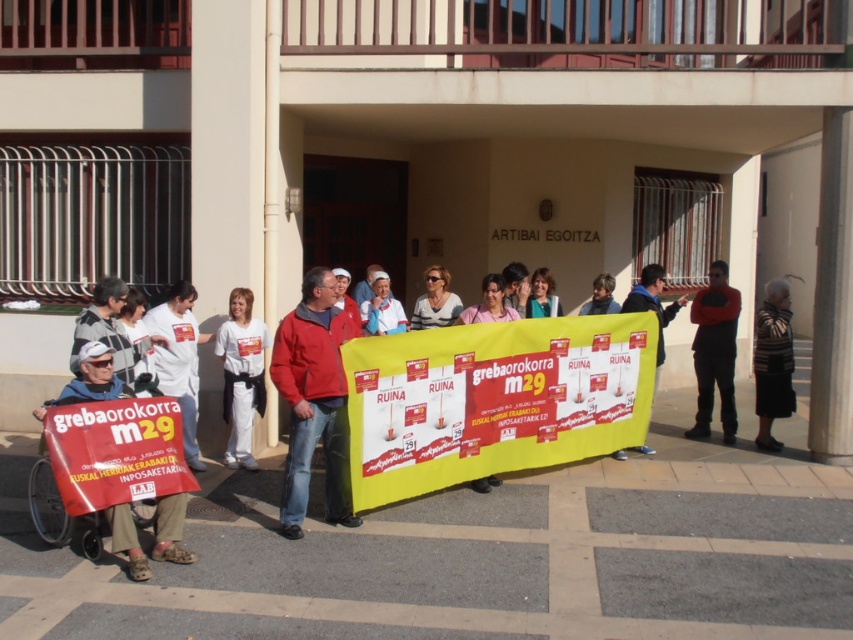
Question: Is black leather jacket at right closer to camera compared to blue denim jeans at center?

Choices:
 (A) no
 (B) yes

Answer: (A)

Question: Is black leather jacket at right thinner than light blue fabric at center?

Choices:
 (A) no
 (B) yes

Answer: (A)

Question: Which point is closer to the camera?

Choices:
 (A) (305, 403)
 (B) (146, 317)

Answer: (A)

Question: Which object appears closest to the camera in this image?

Choices:
 (A) red matte jacket at center
 (B) black leather jacket at right
 (C) white cotton t-shirt at center

Answer: (A)

Question: Among these points, which one is farthest from the camera?

Choices:
 (A) (329, 488)
 (B) (190, 296)

Answer: (B)

Question: Does red matte jacket at center appear on the left side of striped sweater at right?

Choices:
 (A) yes
 (B) no

Answer: (A)